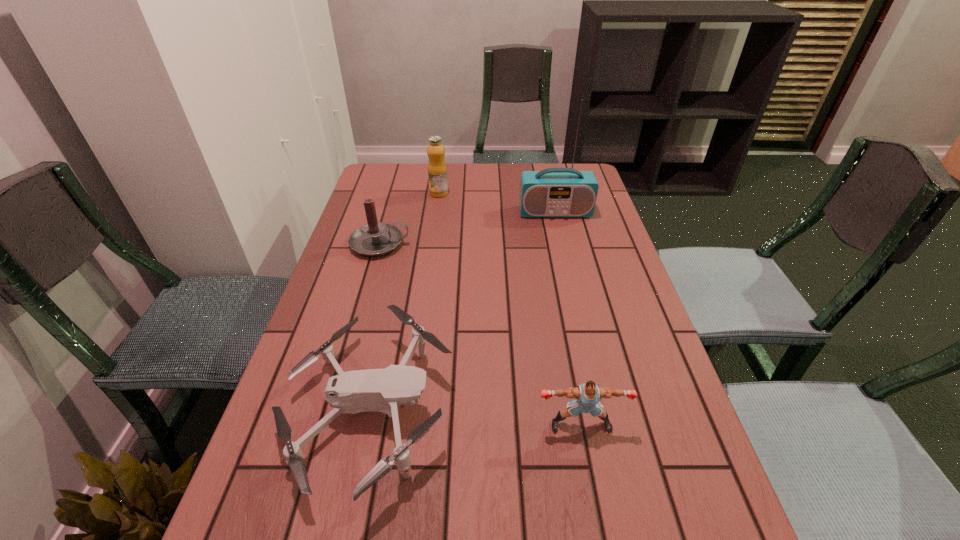
The height and width of the screenshot is (540, 960). Find the location of `the tallest object`. the tallest object is located at coordinates (553, 192).

This screenshot has height=540, width=960. In order to click on the second farthest object in this screenshot , I will do `click(553, 192)`.

At what (x,y) coordinates should I click in order to perform the action: click on fruit juice. Please return your answer as a coordinate pair (x, y). Looking at the image, I should click on (437, 170).

Where is `the farthest object`? Image resolution: width=960 pixels, height=540 pixels. the farthest object is located at coordinates (437, 170).

Where is `the third nearest object`? Image resolution: width=960 pixels, height=540 pixels. the third nearest object is located at coordinates (375, 238).

Where is `puncher`? The image size is (960, 540). puncher is located at coordinates (588, 395).

This screenshot has width=960, height=540. In order to click on the shortest object in this screenshot , I will do `click(379, 390)`.

Image resolution: width=960 pixels, height=540 pixels. I want to click on vacant area located 0.350m on the front panel of the radio receiver, so click(x=575, y=295).

You are a GUI agent. You are given a task and a screenshot of the screen. Output one action in this format:
    pyautogui.click(x=<x>, y=<y>)
    Task: Click on the free location located 0.350m on the front label of the fourth shortest object
    
    Given the screenshot: What is the action you would take?
    pyautogui.click(x=429, y=262)

This screenshot has height=540, width=960. I want to click on blank space located on the side of the candle with the handle loop, so click(x=487, y=244).